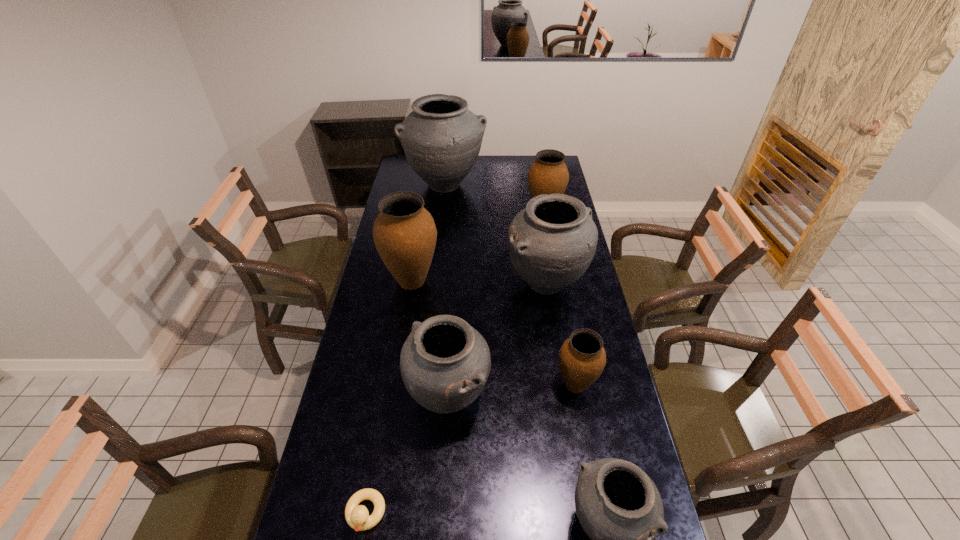
The width and height of the screenshot is (960, 540). Find the location of `empty space between the smallest brown urn and the duckling`. empty space between the smallest brown urn and the duckling is located at coordinates (470, 449).

Image resolution: width=960 pixels, height=540 pixels. I want to click on vacant space that is in between the smallest brown urn and the third smallest black urn, so click(x=561, y=334).

The height and width of the screenshot is (540, 960). I want to click on object that is the nearest to the shortest object, so click(445, 363).

Where is `the sixth closest object to the duckling`? The width and height of the screenshot is (960, 540). the sixth closest object to the duckling is located at coordinates (548, 174).

Find the location of a particular element. The height and width of the screenshot is (540, 960). urn that stands as the fourth closest to the second biggest black urn is located at coordinates (404, 232).

Find the location of a particular element. the seventh closest urn to the duckling is located at coordinates (441, 137).

At what (x,y) coordinates should I click in order to perform the action: click on black urn that is the closest one to the farthest black urn. Please return your answer as a coordinate pair (x, y). Looking at the image, I should click on (551, 243).

You are a GUI agent. You are given a task and a screenshot of the screen. Output one action in this format:
    pyautogui.click(x=<x>, y=<y>)
    Task: Click on the black urn that is the nearest to the biggest brown urn
    
    Given the screenshot: What is the action you would take?
    pyautogui.click(x=551, y=243)

Where is `brown urn that can be found as the closest to the duckling`? brown urn that can be found as the closest to the duckling is located at coordinates (582, 358).

I want to click on the second closest brown urn to the shortest object, so click(404, 232).